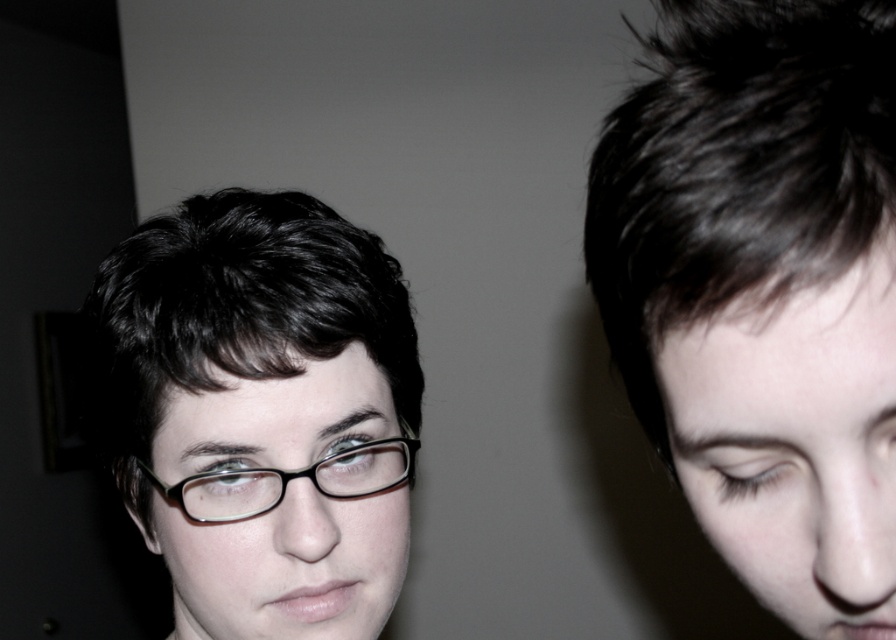
Consider the image. Can you confirm if dark brown hair at upper right is taller than black plastic glasses at center?

Indeed, dark brown hair at upper right has a greater height compared to black plastic glasses at center.

Who is taller, dark brown hair at upper right or black plastic glasses at center?

dark brown hair at upper right is taller.

Is point (764, 353) closer to camera compared to point (359, 458)?

Yes.

Image resolution: width=896 pixels, height=640 pixels. Identify the location of dark brown hair at upper right. (763, 291).

Who is more distant from viewer, (307,467) or (376,461)?

The point (376,461) is more distant.

Can you confirm if matte black glasses at left is thinner than black plastic glasses at center?

Incorrect, matte black glasses at left's width is not less than black plastic glasses at center's.

Is point (237, 632) positioned after point (317, 483)?

That is True.

The height and width of the screenshot is (640, 896). In order to click on matte black glasses at left in this screenshot , I will do pyautogui.click(x=261, y=412).

Between dark brown hair at upper right and matte black glasses at left, which one appears on the right side from the viewer's perspective?

dark brown hair at upper right

Who is more forward, (794,541) or (380,488)?

Positioned in front is point (794,541).

What do you see at coordinates (763, 291) in the screenshot? The width and height of the screenshot is (896, 640). I see `dark brown hair at upper right` at bounding box center [763, 291].

I want to click on dark brown hair at upper right, so click(763, 291).